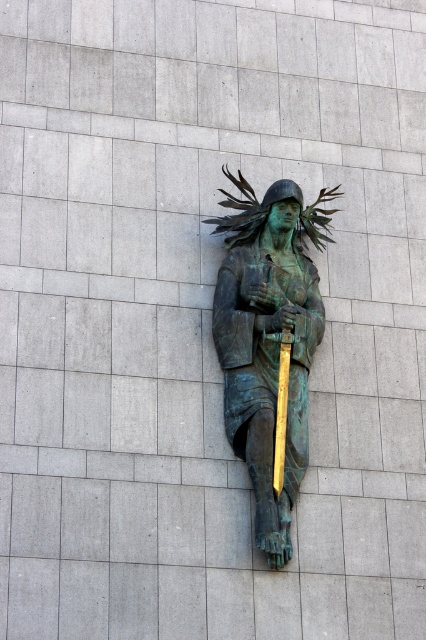
Between green patina bronze statue at center and gold polished spear at center, which one appears on the right side from the viewer's perspective?

gold polished spear at center is more to the right.

Who is lower down, green patina bronze statue at center or gold polished spear at center?

gold polished spear at center is below.

Is point (259, 296) closer to camera compared to point (282, 417)?

No, it is behind (282, 417).

The height and width of the screenshot is (640, 426). Find the location of `green patina bronze statue at center`. green patina bronze statue at center is located at coordinates (268, 339).